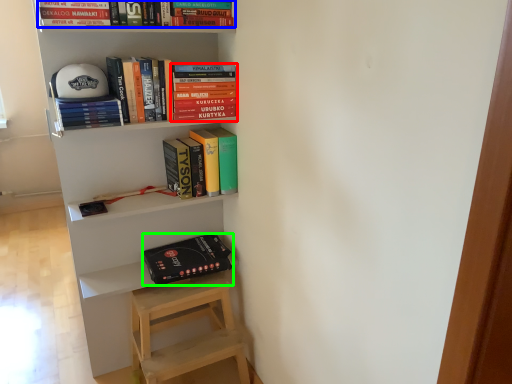
Question: Estimate the real-world distances between objects in this image. Which object is farther from book (highlighted by a red box), book (highlighted by a blue box) or paperback book (highlighted by a green box)?

Choices:
 (A) book
 (B) paperback book

Answer: (B)